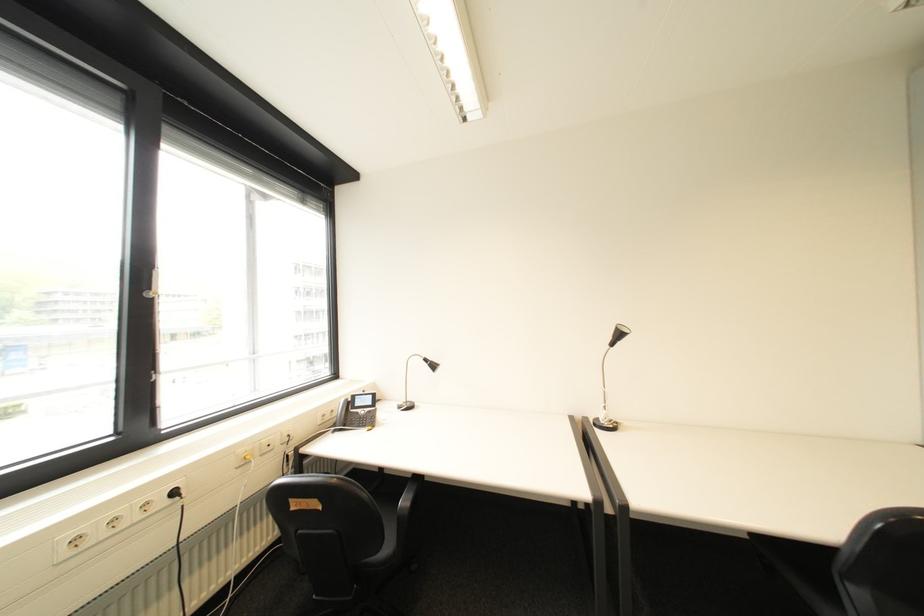
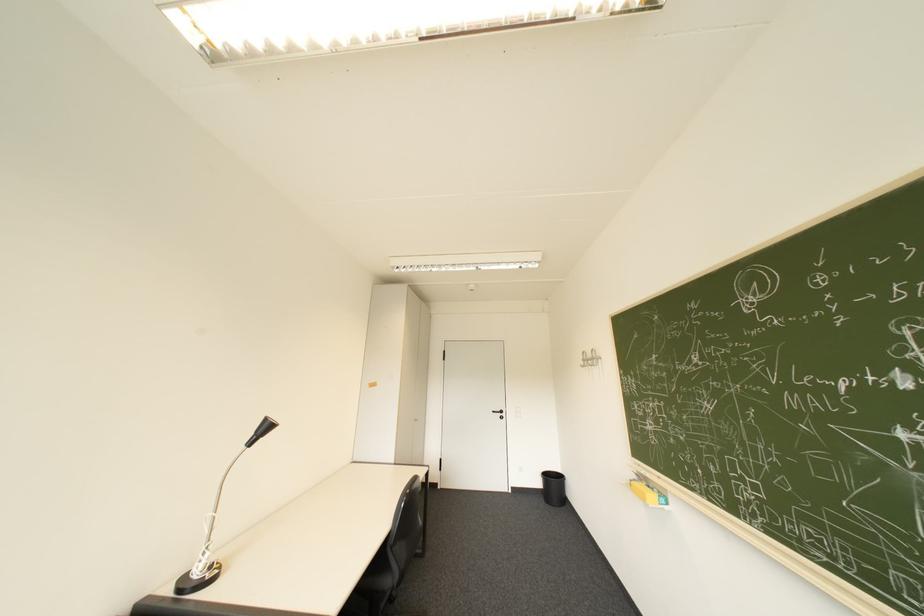
The first image is from the beginning of the video and the second image is from the end. How did the camera likely rotate when shooting the video?

The rotation direction of the camera is right-up.